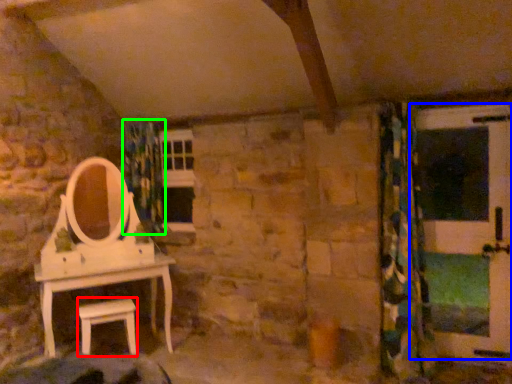
Question: Considering the real-world distances, which object is closest to furniture (highlighted by a red box)? screen door (highlighted by a blue box) or shower curtain (highlighted by a green box).

Choices:
 (A) screen door
 (B) shower curtain

Answer: (B)